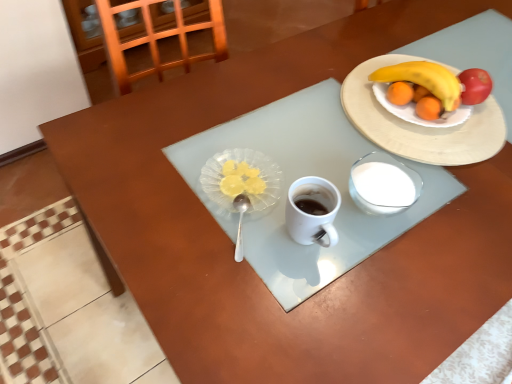
Locate an element on the screen. This screenshot has height=384, width=512. vacant area to the right of silver metallic spoon at center is located at coordinates (x=326, y=246).